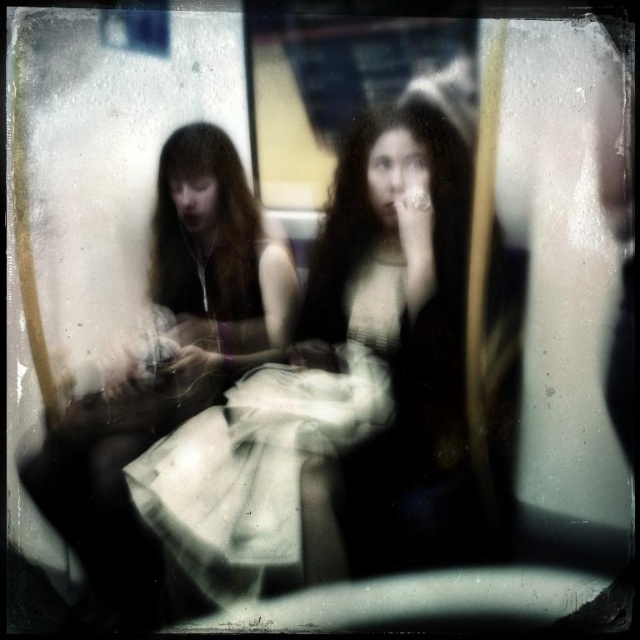
Question: Which point is closer to the camera?

Choices:
 (A) (152, 557)
 (B) (340, 484)

Answer: (A)

Question: Does white fabric dress at center lie behind white cotton dress at center?

Choices:
 (A) yes
 (B) no

Answer: (A)

Question: Is white fabric dress at center in front of white cotton dress at center?

Choices:
 (A) yes
 (B) no

Answer: (B)

Question: Which point appears farthest from the camera in this image?

Choices:
 (A) (230, 305)
 (B) (435, 138)

Answer: (A)

Question: Can you confirm if white fabric dress at center is wider than white cotton dress at center?

Choices:
 (A) yes
 (B) no

Answer: (A)